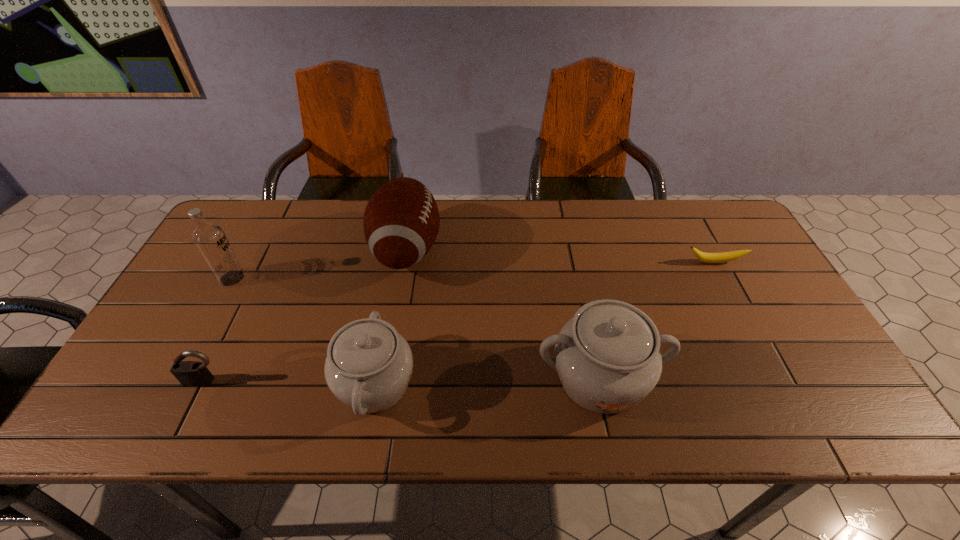
I want to click on vacant space situated 0.050m on the left of the right chinaware, so click(514, 379).

Where is `free space located 0.340m on the front label of the vodka`? This screenshot has width=960, height=540. free space located 0.340m on the front label of the vodka is located at coordinates (365, 279).

The image size is (960, 540). What are the coordinates of `free spot located 0.110m on the laces of the football` in the screenshot? It's located at (478, 249).

Where is `blank space located on the upward curve of the banana`? blank space located on the upward curve of the banana is located at coordinates (769, 364).

The width and height of the screenshot is (960, 540). I want to click on object present at the far edge, so click(401, 221).

Where is `padlock that is at the near edge`? Image resolution: width=960 pixels, height=540 pixels. padlock that is at the near edge is located at coordinates click(189, 373).

Identify the location of vodka present at the left edge. The image size is (960, 540). (209, 238).

I want to click on padlock present at the left edge, so click(189, 373).

Find the location of a particular element. object that is at the right edge is located at coordinates (721, 257).

Where is `object located at the near left corner`? object located at the near left corner is located at coordinates (189, 373).